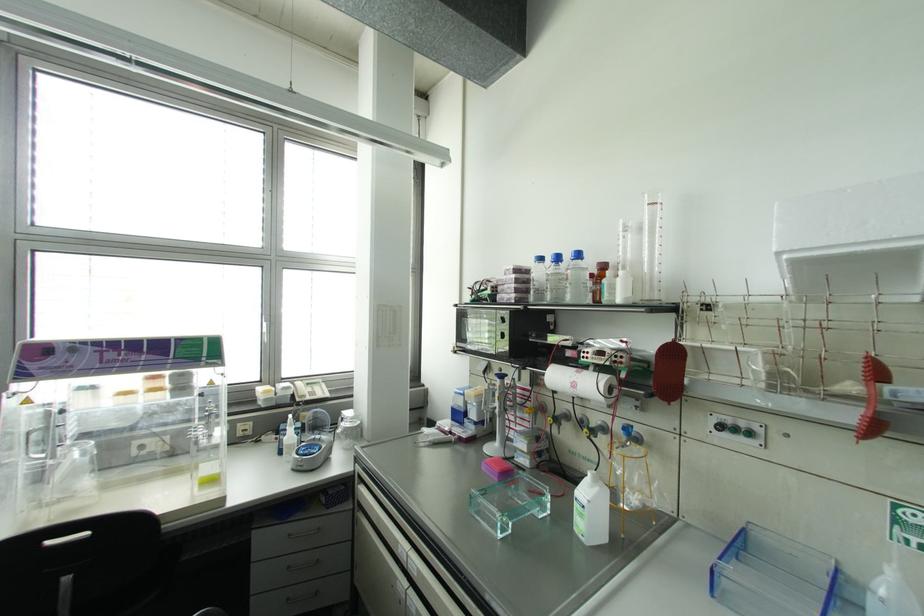
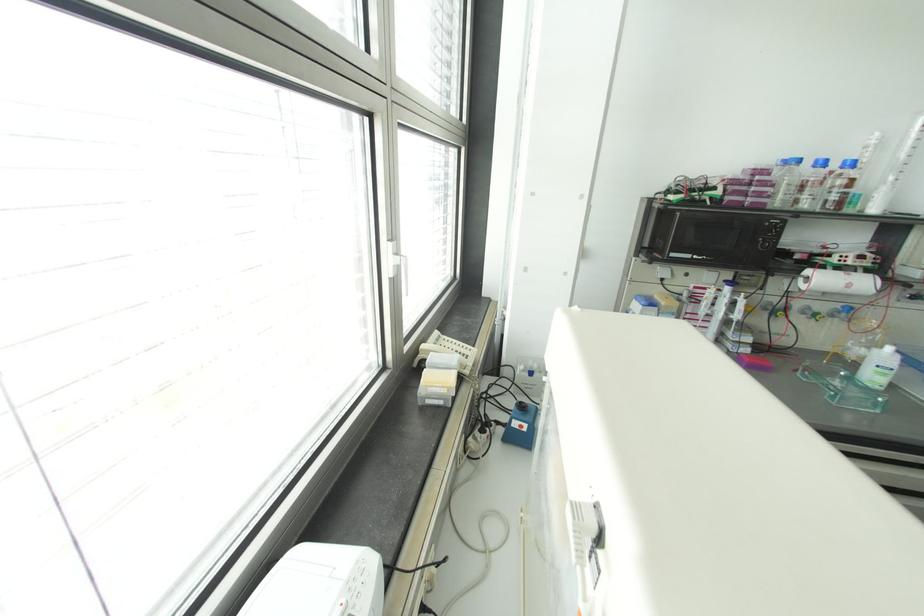
Find the pixel in the second image that matches the point at 578,254 in the first image.

(852, 163)